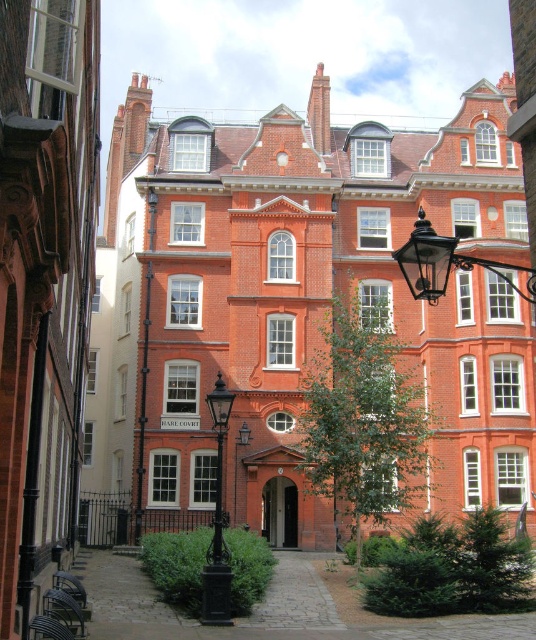
You are a visitor standing in the courtyard and want to walk from the black wrought iron lamp post at center to the black wrought iron streetlight at upper right. Is the path clear, or will you have to go around the streetlight?

The black wrought iron streetlight at upper right is positioned over the black wrought iron lamp post at center, so the path is blocked by the streetlight. You will need to go around it to reach the destination.

You are a visitor standing in the courtyard of the historic building. You notice two black wrought iron lighting fixtures. Which one is bigger between the black wrought iron streetlight at upper right and the black wrought iron lamp post at center?

The black wrought iron streetlight at upper right is larger in size compared to the black wrought iron lamp post at center.